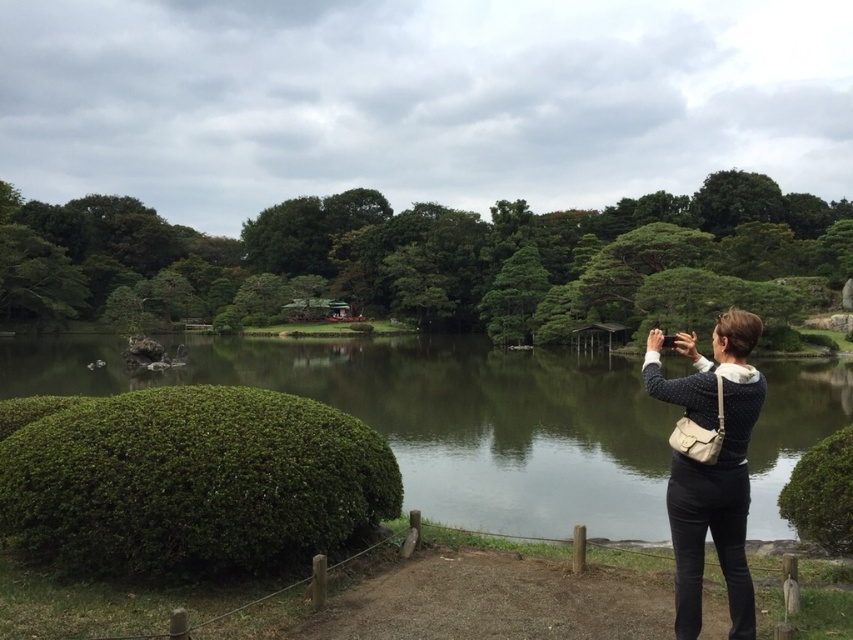
Is point (705, 492) in front of point (790, 518)?

Yes, it is in front of point (790, 518).

Does point (660, 397) come closer to viewer compared to point (817, 483)?

Yes, it is.

Locate an element on the screen. knitted sweater at center is located at coordinates (711, 467).

Between green grassy mound at lower left and green leafy tree at center, which one is positioned lower?

green grassy mound at lower left

Between point (535, 401) and point (583, 289), which one is positioned in front?

Point (535, 401)

This screenshot has height=640, width=853. I want to click on green grassy mound at lower left, so point(434,419).

Is green leafy tree at center thinner than green bushy hedge at lower left?

No.

Who is shorter, green leafy tree at center or green bushy hedge at lower left?

green bushy hedge at lower left is shorter.

Does point (305, 202) lie in front of point (196, 554)?

No, (305, 202) is behind (196, 554).

This screenshot has height=640, width=853. What are the coordinates of `green leafy tree at center` in the screenshot? It's located at (428, 248).